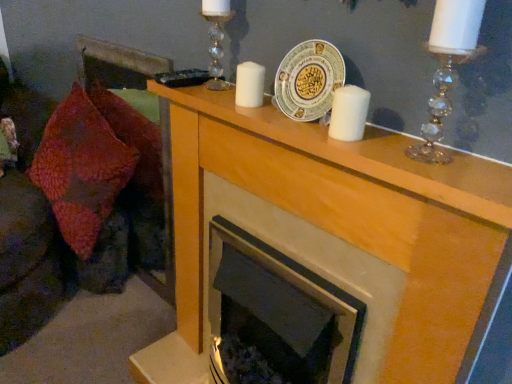
Question: Considering the positions of clear crystal candle holder at upper right, the second candle holder from the back, and wooden mantlepiece at upper center in the image, is clear crystal candle holder at upper right, the second candle holder from the back, taller or shorter than wooden mantlepiece at upper center?

Choices:
 (A) tall
 (B) short

Answer: (B)

Question: Is point (410, 155) positioned closer to the camera than point (399, 162)?

Choices:
 (A) closer
 (B) farther

Answer: (B)

Question: Which of these objects is positioned closest to the clear crystal candle holder at upper center, the second candle holder viewed from the front?

Choices:
 (A) white matte candle at center, which ranks as the first candle in top-to-bottom order
 (B) white matte candle at center, the 2th candle positioned from the left
 (C) clear crystal candle holder at upper right, the second candle holder from the back
 (D) wooden mantlepiece at upper center
 (E) white ceramic plate at center

Answer: (A)

Question: Estimate the real-world distances between objects in this image. Which object is closer to the wooden mantlepiece at upper center?

Choices:
 (A) white matte candle at center, the second candle viewed from the front
 (B) velvet textured throw pillow at left
 (C) clear crystal candle holder at upper center, the second candle holder viewed from the front
 (D) white ceramic plate at center
 (E) clear crystal candle holder at upper right, which is counted as the 1th candle holder, starting from the front

Answer: (D)